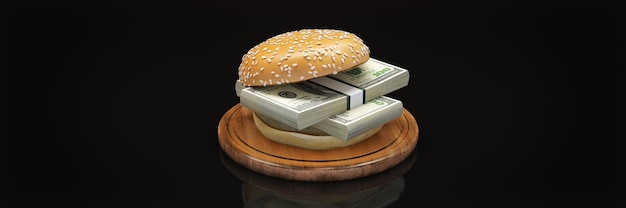
I want to click on wooden circle platform, so click(393, 166).